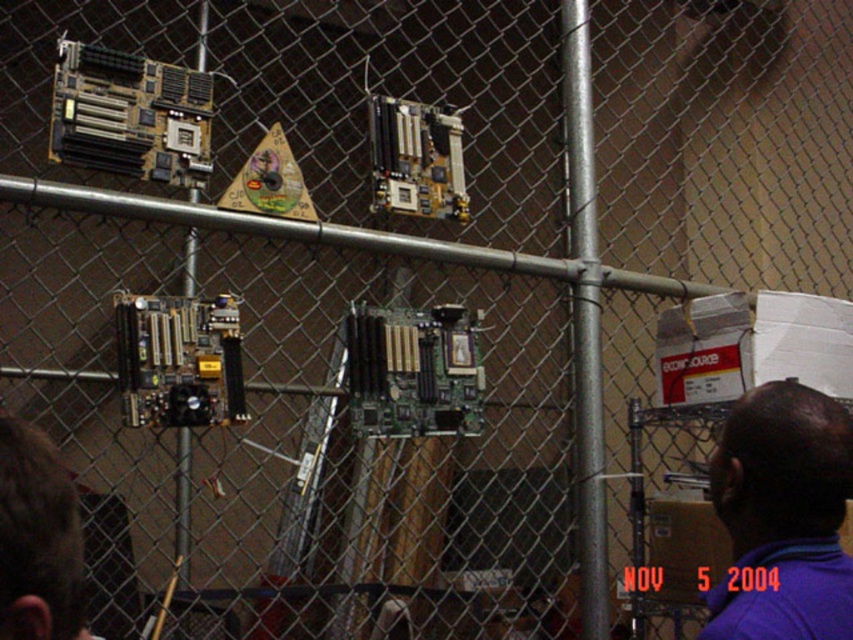
You are an employee at the recycling center and need to determine which item is wider for proper sorting. You see a purple fabric shirt at upper right and a brown hair at lower left. Which one has a greater width?

The purple fabric shirt at upper right has a greater width than the brown hair at lower left according to the description.

You are an inspector in a recycling center. You need to check the purple fabric shirt at upper right and the brown hair at lower left. Which one should you inspect first if you want to check the closer item first?

You should inspect the purple fabric shirt at upper right first because it is closer to you than the brown hair at lower left.